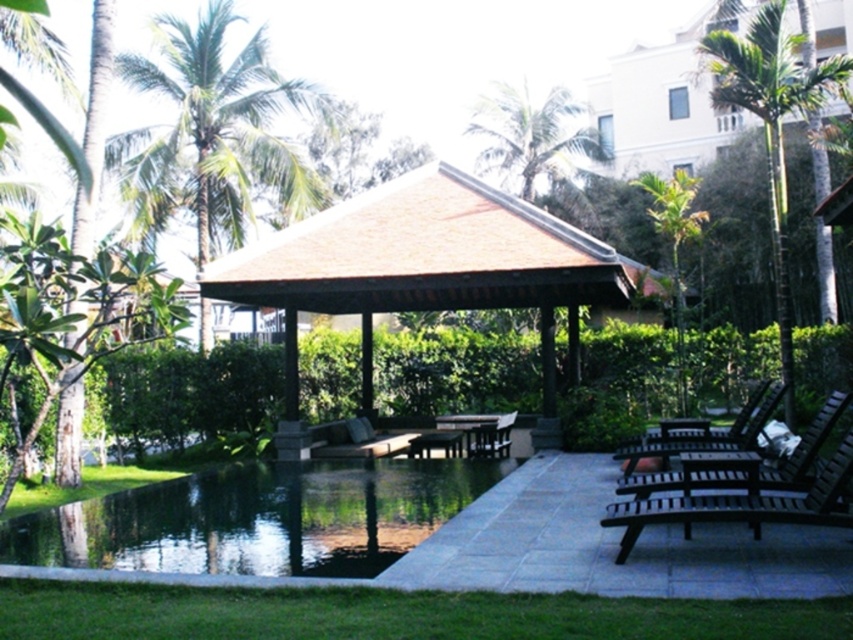
You are planning to place a large sun umbrella next to the dark brown wooden lounge chair at lower right and the brown wooden chair at center. Which chair should you place it closer to if you want to ensure it provides shade for both chairs equally?

The dark brown wooden lounge chair at lower right is bigger than the brown wooden chair at center, so placing the umbrella closer to the larger chair would help balance the shade coverage between both chairs.

You are planning to take a photo of the green leafy palm tree at upper center and the wooden lounge chair at center from the edge of the pool. Which object will appear wider in the photo?

The wooden lounge chair at center will appear wider in the photo because it has a greater width than the green leafy palm tree at upper center.

You are standing at the edge of the pool and want to sit down. Which chair, the brown wooden chair at center or the wooden lounge chair at center, is closer to you?

The brown wooden chair at center is closer to you because it is positioned over the wooden lounge chair at center, meaning it is in front and nearer to your current position at the pool edge.